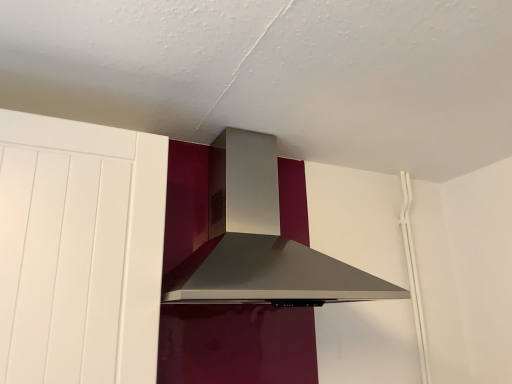
Where is `satin gray range hood at center`? The image size is (512, 384). satin gray range hood at center is located at coordinates (260, 241).

Describe the element at coordinates (260, 241) in the screenshot. I see `satin gray range hood at center` at that location.

Find the location of a particular element. This screenshot has width=512, height=384. satin gray range hood at center is located at coordinates (260, 241).